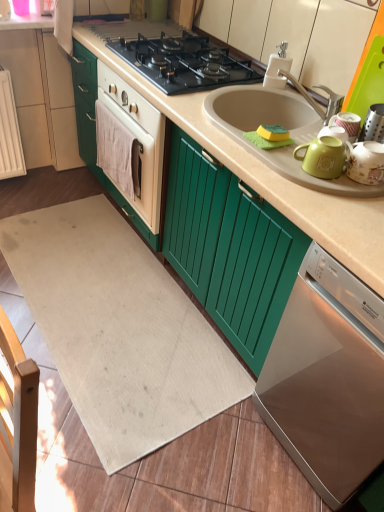
Identify the location of vacant space underneath satin silver dishwasher at lower right (from a real-world perspective). (312, 433).